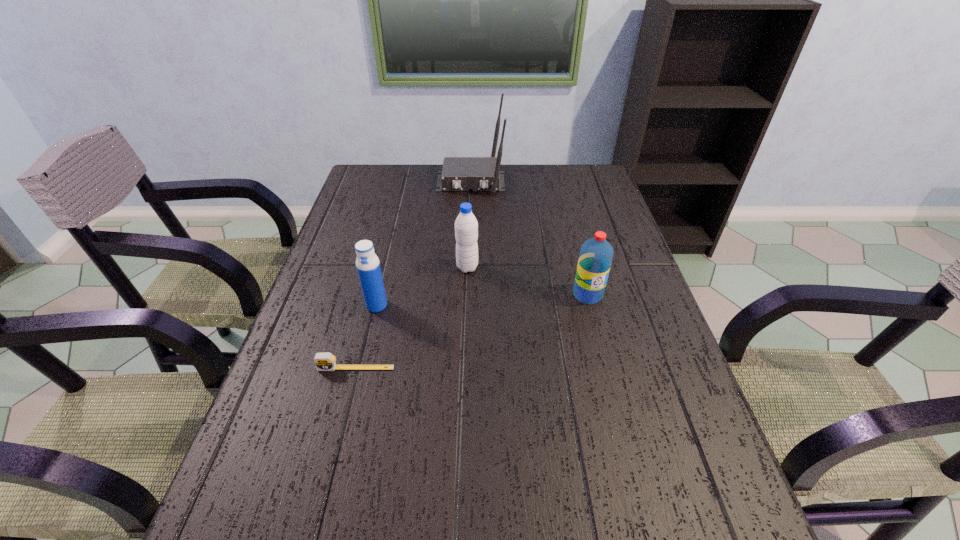
Image resolution: width=960 pixels, height=540 pixels. Find the location of `the closest object relative to the tape measure`. the closest object relative to the tape measure is located at coordinates (368, 267).

Where is `object identified as the second closest to the nearest object`? This screenshot has height=540, width=960. object identified as the second closest to the nearest object is located at coordinates (466, 226).

Point out which water bottle is positioned as the second nearest to the shortest object. Please provide its 2D coordinates. Your answer should be formatted as a tuple, i.e. [(x, y)], where the tuple contains the x and y coordinates of a point satisfying the conditions above.

[(466, 226)]

You are a GUI agent. You are given a task and a screenshot of the screen. Output one action in this format:
    pyautogui.click(x=<x>, y=<y>)
    Task: Click on the third closest water bottle to the tape measure
    The height and width of the screenshot is (540, 960).
    Given the screenshot: What is the action you would take?
    pyautogui.click(x=596, y=254)